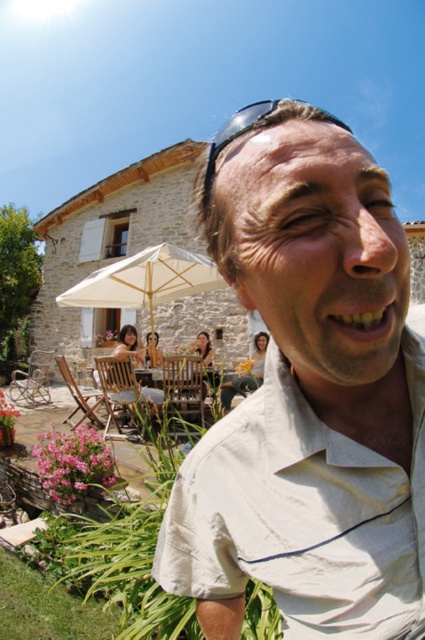
Question: Can you confirm if beige cotton shirt at center is positioned to the left of sunglasses at upper center?

Choices:
 (A) yes
 (B) no

Answer: (A)

Question: Does beige cotton shirt at center come behind sunglasses at upper center?

Choices:
 (A) yes
 (B) no

Answer: (B)

Question: Can you confirm if beige fabric umbrella at center is positioned below sunglasses at upper center?

Choices:
 (A) yes
 (B) no

Answer: (A)

Question: Which point appears closest to the camera in this image?

Choices:
 (A) (299, 417)
 (B) (138, 305)
 (C) (215, 141)

Answer: (A)

Question: Which of the following is the closest to the observer?

Choices:
 (A) (124, 291)
 (B) (274, 102)
 (C) (283, 314)

Answer: (C)

Question: Based on their relative distances, which object is nearer to the beige cotton shirt at center?

Choices:
 (A) beige fabric umbrella at center
 (B) sunglasses at upper center

Answer: (B)